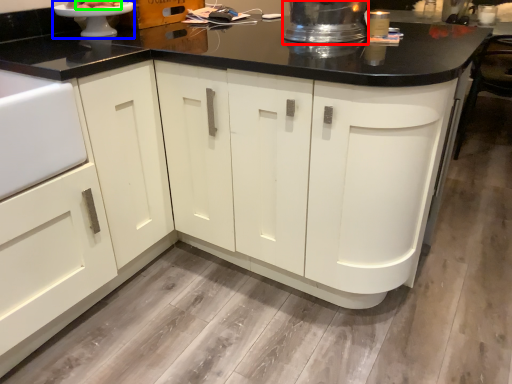
Question: Which object is the farthest from appliance (highlighted by a red box)? Choose among these: appliance (highlighted by a blue box) or food (highlighted by a green box).

Choices:
 (A) appliance
 (B) food

Answer: (B)